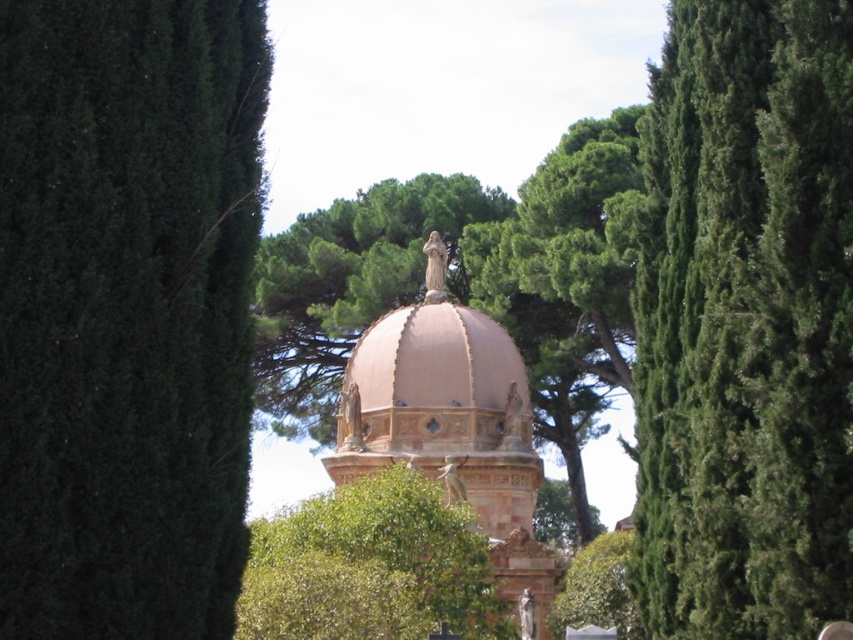
Question: Among these objects, which one is nearest to the camera?

Choices:
 (A) green textured tree at left
 (B) pink stone dome at center
 (C) green leafy tree at center
 (D) green textured tree at right

Answer: (A)

Question: Observing the image, what is the correct spatial positioning of pink stone dome at center in reference to green leafy tree at center?

Choices:
 (A) above
 (B) below

Answer: (A)

Question: Does green textured tree at left lie behind green leafy tree at center?

Choices:
 (A) no
 (B) yes

Answer: (A)

Question: Does green textured tree at left have a lesser width compared to pink stone dome at center?

Choices:
 (A) yes
 (B) no

Answer: (A)

Question: Which point is farther to the camera?

Choices:
 (A) green leafy tree at center
 (B) green textured tree at right
 (C) green textured tree at left

Answer: (A)

Question: Estimate the real-world distances between objects in this image. Which object is farther from the green textured tree at left?

Choices:
 (A) pink stone dome at center
 (B) green leafy tree at center

Answer: (A)